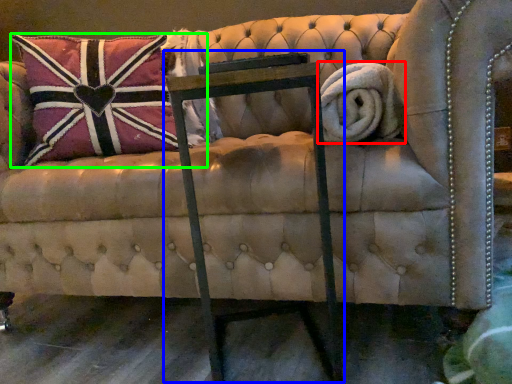
Question: Which is farther away from bath towel (highlighted by a red box)? rocking chair (highlighted by a blue box) or pillow (highlighted by a green box)?

Choices:
 (A) rocking chair
 (B) pillow

Answer: (B)